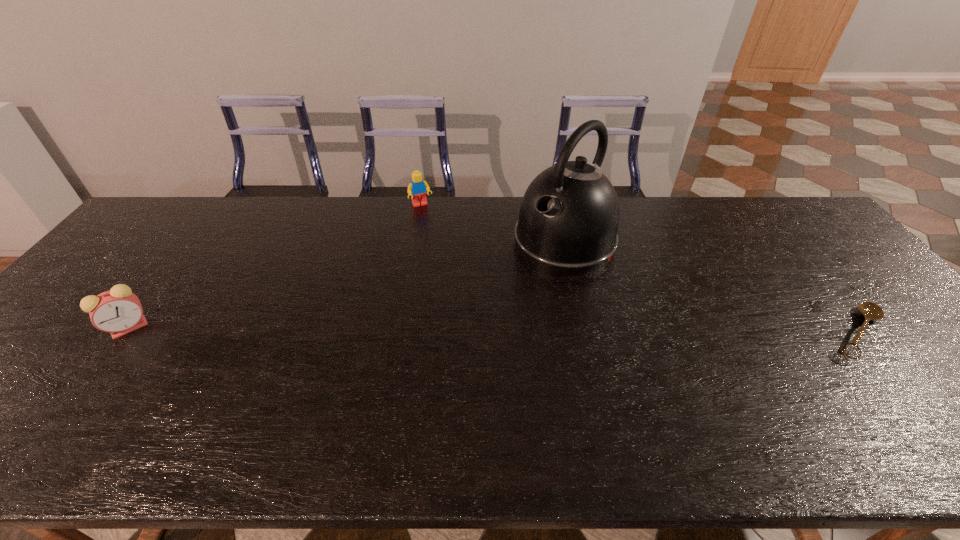
Find the location of a particular element. Image resolution: width=960 pixels, height=540 pixels. vacant area at the near edge is located at coordinates coord(792,403).

The width and height of the screenshot is (960, 540). I want to click on free spot at the left edge of the desktop, so (x=60, y=340).

Image resolution: width=960 pixels, height=540 pixels. Find the location of `free location at the right edge of the desktop`. free location at the right edge of the desktop is located at coordinates click(854, 324).

Locate an element on the screen. The width and height of the screenshot is (960, 540). vacant area at the far left corner of the desktop is located at coordinates (156, 227).

Where is `free space between the tallest object and the shortest object`? Image resolution: width=960 pixels, height=540 pixels. free space between the tallest object and the shortest object is located at coordinates (711, 287).

Where is `vacant space that's between the second object from left to right and the leftmost object`? vacant space that's between the second object from left to right and the leftmost object is located at coordinates (276, 266).

Where is `free space that is in between the shortest object and the second farthest object`? free space that is in between the shortest object and the second farthest object is located at coordinates pos(711,287).

The height and width of the screenshot is (540, 960). In order to click on vacant point located between the farthest object and the leftmost object in this screenshot , I will do `click(276, 266)`.

Locate an element on the screen. vacant space that is in between the leftmost object and the third object from left to right is located at coordinates (347, 285).

You are a GUI agent. You are given a task and a screenshot of the screen. Output one action in this format:
    pyautogui.click(x=<x>, y=<y>)
    Task: Click on the vacant area that lies between the third object from left to right and the Lego
    
    Given the screenshot: What is the action you would take?
    pyautogui.click(x=492, y=224)